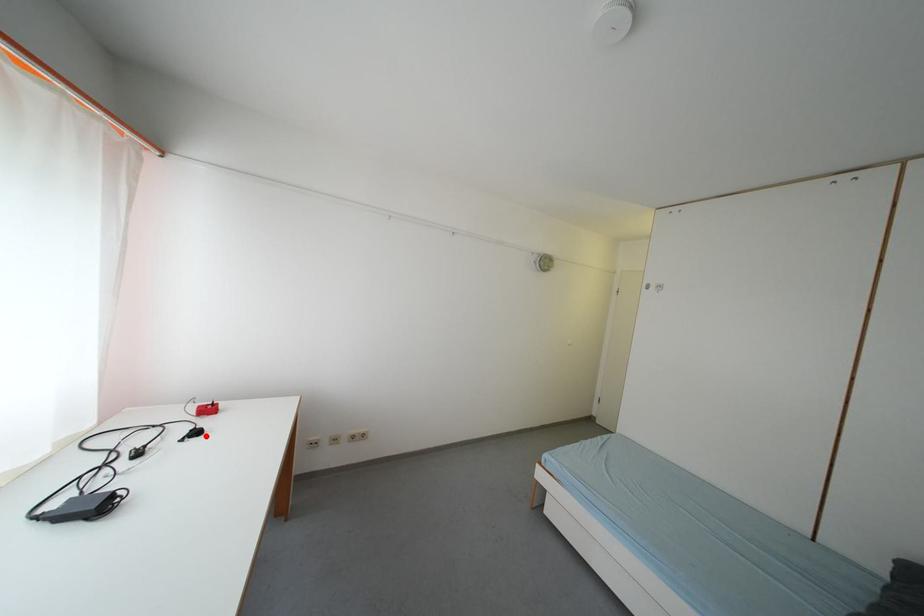
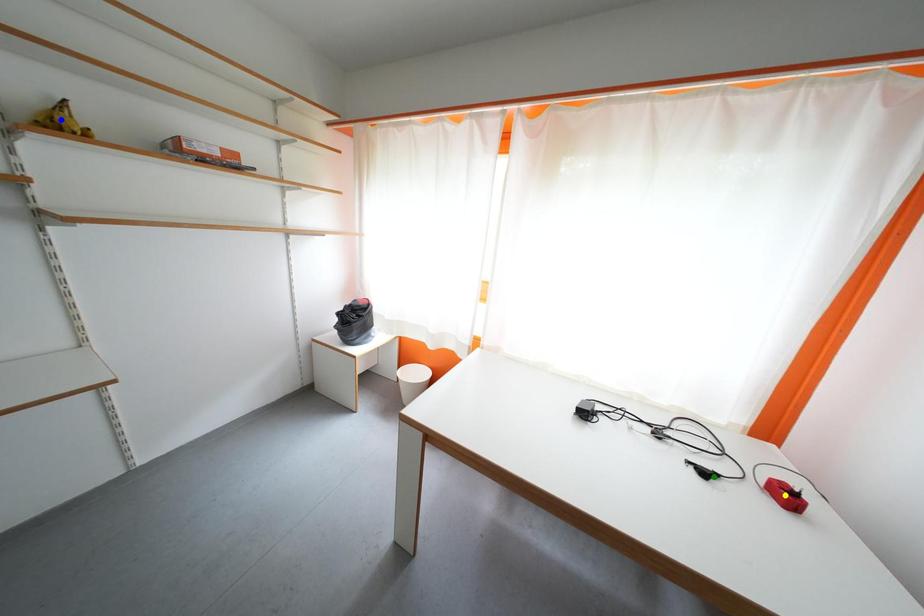
Question: I am providing you with two images of the same scene from different viewpoints. A red point is marked on the first image. You are given multiple points on the second image. Which point in image 2 is actually the same real-world point as the red point in image 1?

Choices:
 (A) yellow point
 (B) blue point
 (C) green point

Answer: (C)